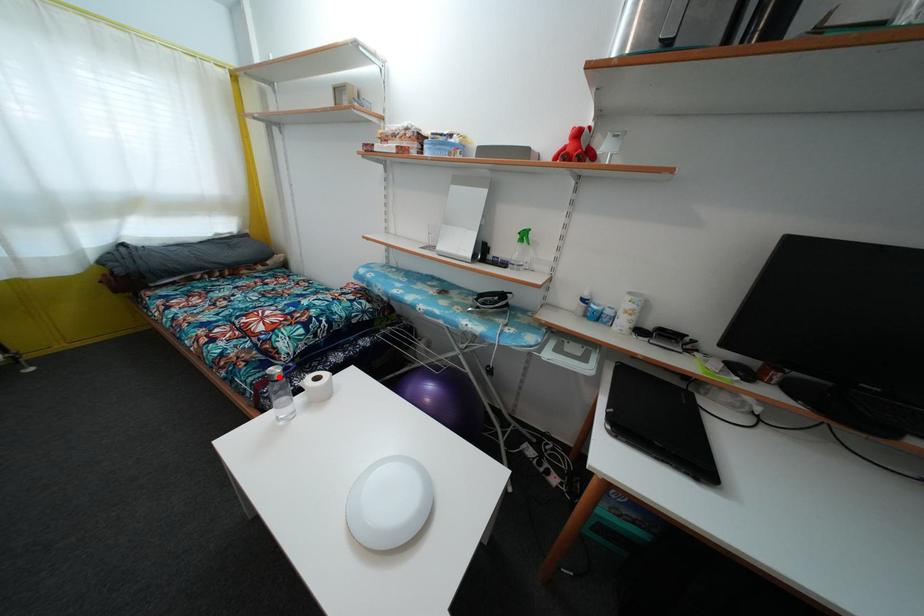
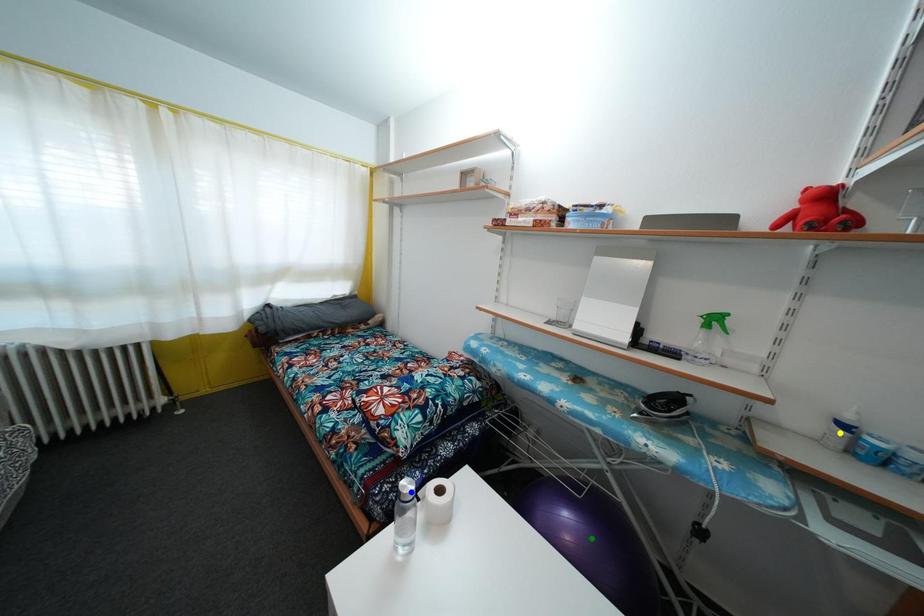
Question: I am providing you with two images of the same scene from different viewpoints. A red point is marked on the first image. You are given multiple points on the second image. Which point in image 2 is actually the same real-world point as the red point in image 1?

Choices:
 (A) blue point
 (B) yellow point
 (C) green point

Answer: (A)